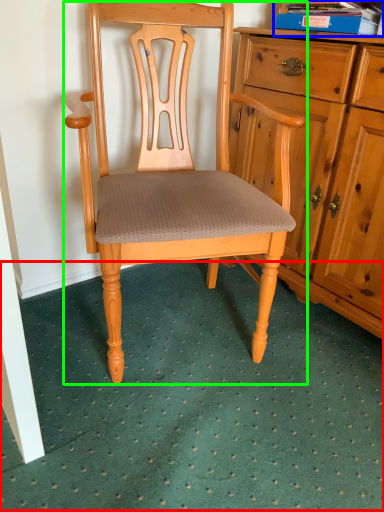
Question: Estimate the real-world distances between objects in this image. Which object is farther from doormat (highlighted by a red box), book (highlighted by a blue box) or chair (highlighted by a green box)?

Choices:
 (A) book
 (B) chair

Answer: (A)